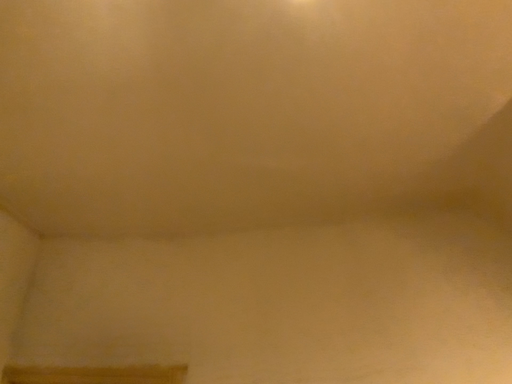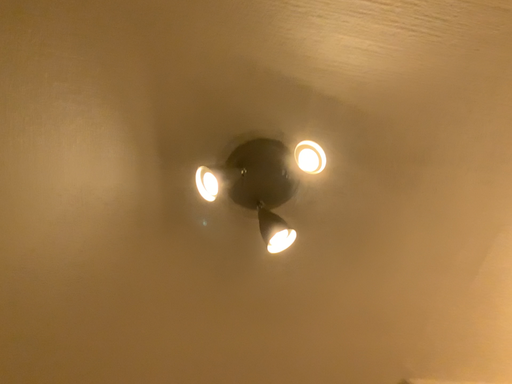
Question: Which way did the camera rotate in the video?

Choices:
 (A) rotated left
 (B) rotated right

Answer: (B)